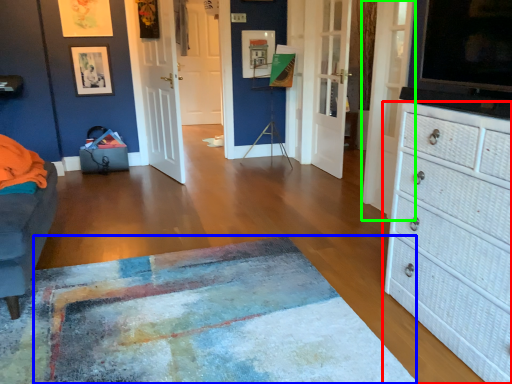
Question: Based on their relative distances, which object is nearer to chest of drawers (highlighted by a red box)? Choose from mat (highlighted by a blue box) and door (highlighted by a green box).

Choices:
 (A) mat
 (B) door

Answer: (A)